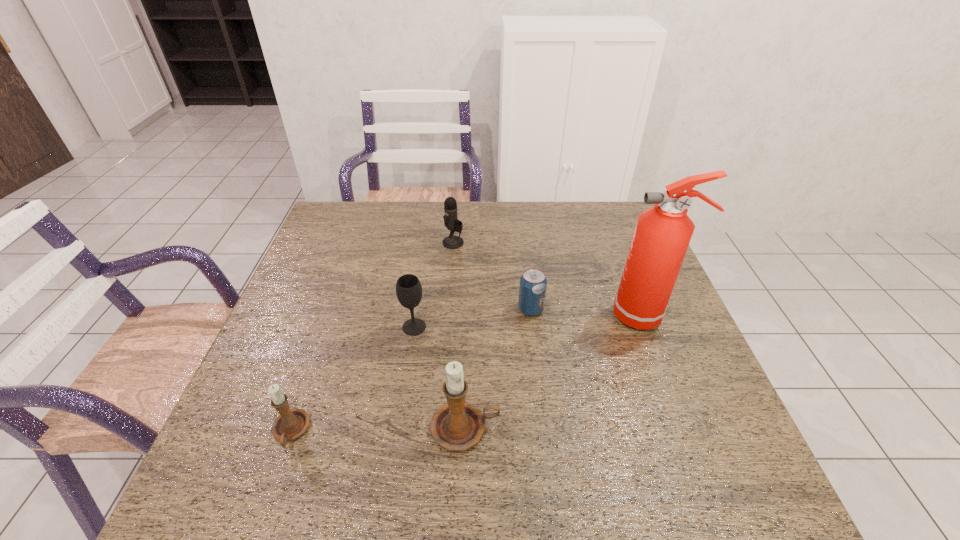
Identify the location of vacant point that satisfies the following two spatial constraints: 1. on the back side of the pop soda; 2. on the left side of the fifth object from right to left. This screenshot has height=540, width=960. (417, 309).